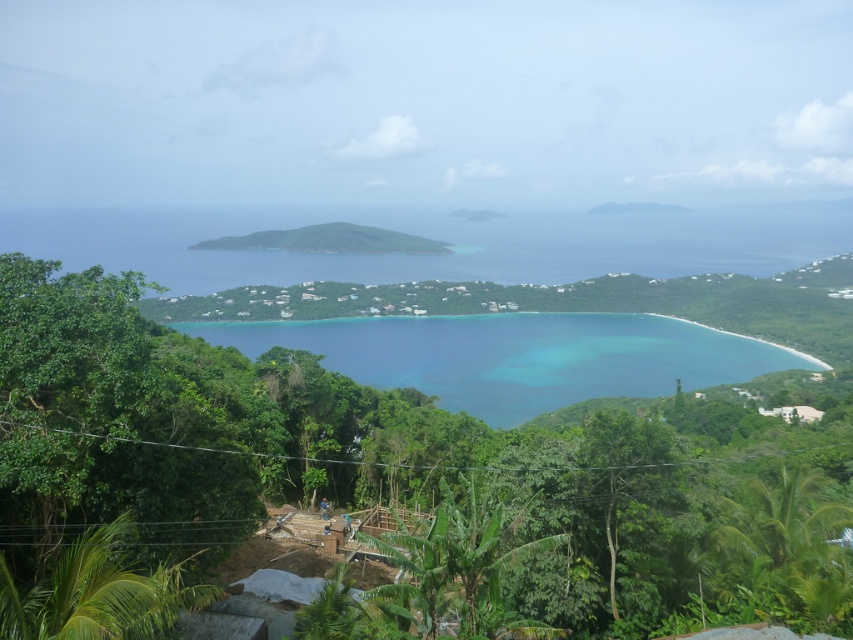
Question: Which point is closer to the camera taking this photo?

Choices:
 (A) (142, 465)
 (B) (291, 243)

Answer: (A)

Question: Can you confirm if green leafy trees at center is thinner than turquoise water at center?

Choices:
 (A) no
 (B) yes

Answer: (B)

Question: Is green leafy trees at center wider than turquoise water at center?

Choices:
 (A) yes
 (B) no

Answer: (B)

Question: Which object appears farthest from the camera in this image?

Choices:
 (A) turquoise water at center
 (B) green leafy hill at center

Answer: (B)

Question: Does green leafy trees at center appear on the left side of turquoise water at center?

Choices:
 (A) yes
 (B) no

Answer: (A)

Question: Which object is the closest to the green leafy trees at center?

Choices:
 (A) green leafy hill at center
 (B) turquoise water at center

Answer: (B)